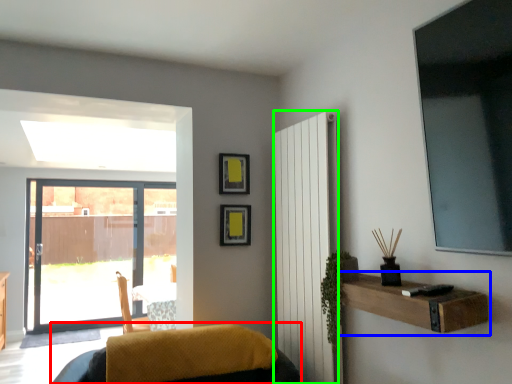
Question: Which object is the closest to the furniture (highlighted by a red box)? Choose among these: shelf (highlighted by a blue box) or radiator (highlighted by a green box).

Choices:
 (A) shelf
 (B) radiator

Answer: (B)